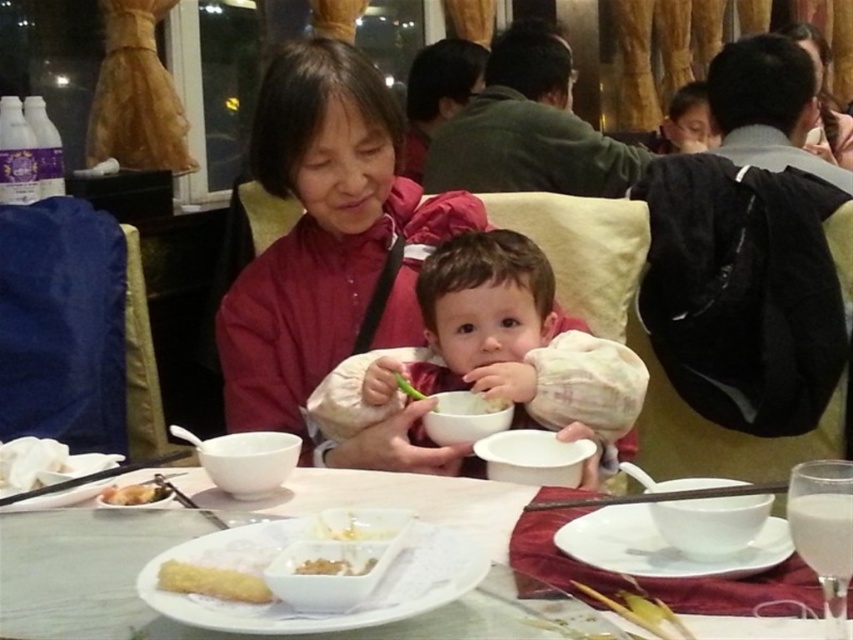
Between white glossy table at center and golden fried pastry at lower left, which one has more height?

Standing taller between the two is white glossy table at center.

This screenshot has height=640, width=853. What do you see at coordinates (97, 568) in the screenshot? I see `white glossy table at center` at bounding box center [97, 568].

The image size is (853, 640). I want to click on white glossy table at center, so click(97, 568).

Does black plastic chopsticks at upper center appear over golden fried pastry at lower left?

Yes.

At what (x,y) coordinates should I click in order to perform the action: click on black plastic chopsticks at upper center. Please return your answer as a coordinate pair (x, y). The width and height of the screenshot is (853, 640). Looking at the image, I should click on (660, 497).

Does golden crispy pastry at lower left come behind golden fried pastry at lower left?

That is False.

Is point (186, 586) closer to camera compared to point (154, 486)?

Yes, point (186, 586) is in front of point (154, 486).

Where is `golden crispy pastry at lower left`? Image resolution: width=853 pixels, height=640 pixels. golden crispy pastry at lower left is located at coordinates (212, 580).